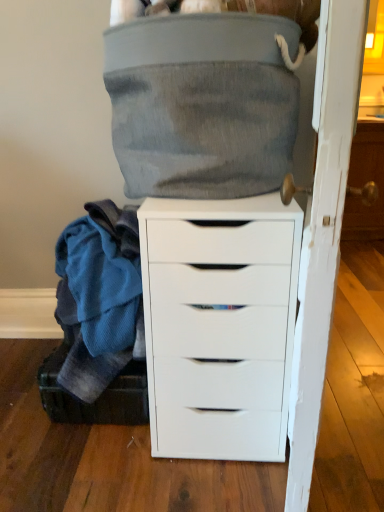
Question: Can you confirm if white matte chest of drawers at center is shorter than white wood door at right?

Choices:
 (A) yes
 (B) no

Answer: (A)

Question: Considering the relative sizes of white matte chest of drawers at center and white wood door at right in the image provided, is white matte chest of drawers at center thinner than white wood door at right?

Choices:
 (A) yes
 (B) no

Answer: (B)

Question: Can we say white matte chest of drawers at center lies outside white wood door at right?

Choices:
 (A) yes
 (B) no

Answer: (A)

Question: Is white matte chest of drawers at center wider than white wood door at right?

Choices:
 (A) yes
 (B) no

Answer: (A)

Question: Does white matte chest of drawers at center appear on the left side of white wood door at right?

Choices:
 (A) yes
 (B) no

Answer: (A)

Question: Is white matte chest of drawers at center positioned with its back to white wood door at right?

Choices:
 (A) yes
 (B) no

Answer: (B)

Question: Considering the relative positions of white wood door at right and white matte chest of drawers at center in the image provided, is white wood door at right to the left of white matte chest of drawers at center from the viewer's perspective?

Choices:
 (A) no
 (B) yes

Answer: (A)

Question: Is white wood door at right oriented away from white matte chest of drawers at center?

Choices:
 (A) no
 (B) yes

Answer: (A)

Question: From a real-world perspective, is white wood door at right positioned under white matte chest of drawers at center based on gravity?

Choices:
 (A) yes
 (B) no

Answer: (B)

Question: Does white wood door at right have a lesser width compared to white matte chest of drawers at center?

Choices:
 (A) no
 (B) yes

Answer: (B)

Question: Considering the relative sizes of white wood door at right and white matte chest of drawers at center in the image provided, is white wood door at right shorter than white matte chest of drawers at center?

Choices:
 (A) no
 (B) yes

Answer: (A)

Question: From a real-world perspective, is white wood door at right located higher than white matte chest of drawers at center?

Choices:
 (A) no
 (B) yes

Answer: (B)

Question: Is black fabric shoe box at lower left surrounded by white matte chest of drawers at center?

Choices:
 (A) no
 (B) yes

Answer: (A)